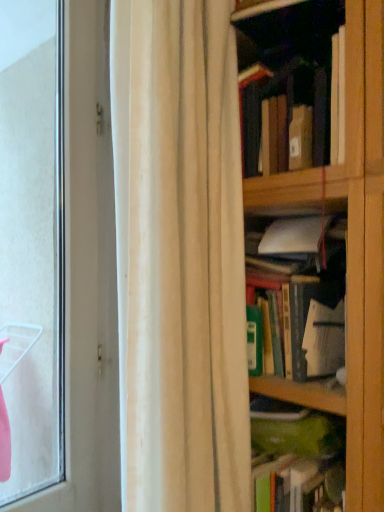
Question: In terms of size, does green matte book at center, which appears as the 2th book when viewed from the top, appear bigger or smaller than transparent glass window at left?

Choices:
 (A) small
 (B) big

Answer: (A)

Question: From the image's perspective, is green matte book at center, which ranks as the 2th book in bottom-to-top order, located above or below transparent glass window at left?

Choices:
 (A) above
 (B) below

Answer: (B)

Question: Estimate the real-world distances between objects in this image. Which object is closer to the green matte book at center, which appears as the 2th book when viewed from the top?

Choices:
 (A) hardcover book at upper right, which is the first book from top to bottom
 (B) green matte book at center, which ranks as the 3th book in top-to-bottom order
 (C) white fabric curtain at center
 (D) transparent glass window at left

Answer: (B)

Question: Which object is positioned farthest from the hardcover book at upper right, marked as the 3th book in a bottom-to-top arrangement?

Choices:
 (A) white fabric curtain at center
 (B) transparent glass window at left
 (C) green matte book at center, the 1th book from the bottom
 (D) green matte book at center, which ranks as the 2th book in bottom-to-top order

Answer: (B)